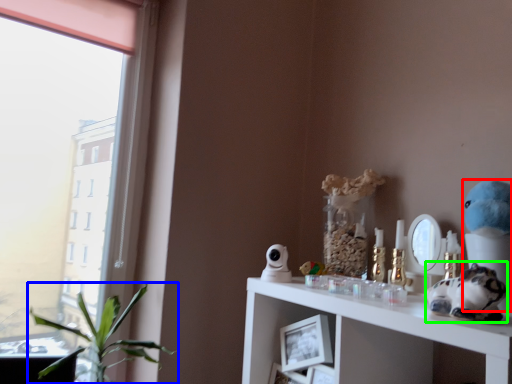
Question: Which is nearer to the figurine (highlighted by a red box)? houseplant (highlighted by a blue box) or toy (highlighted by a green box).

Choices:
 (A) houseplant
 (B) toy

Answer: (B)